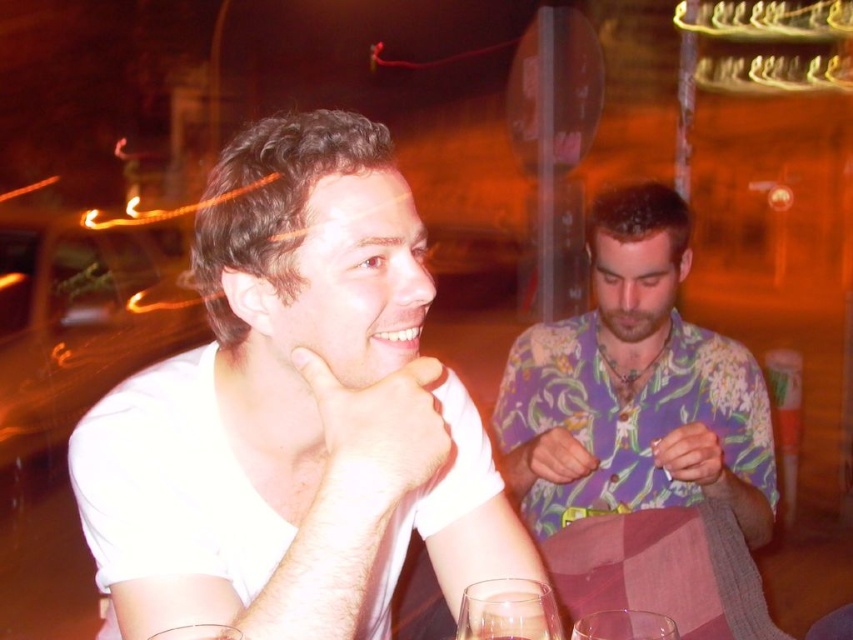
You are standing at the entrance of the outdoor dining area and want to locate the white matte shirt at left. Based on the coordinates provided, in which direction should you look to find it?

The white matte shirt at left is located at coordinates point (294, 410), so you should look to the upper right direction to find it.

You are a photographer trying to capture a candid shot of both the white matte shirt at left and the floral print shirt at center. Based on their positions, which one is closer to the camera?

The white matte shirt at left is located below the floral print shirt at center, which means the floral print shirt at center is closer to the camera.

You are a waiter at a restaurant and need to place a 20 cm wide dessert menu between the white matte shirt at left and the clear glass wine glass at lower center. Can you fit the dessert menu between them without moving either object?

The white matte shirt at left and the clear glass wine glass at lower center are 25.62 centimeters apart from each other. Since the dessert menu is 20 cm wide, there is enough space to place it between them without moving either object.